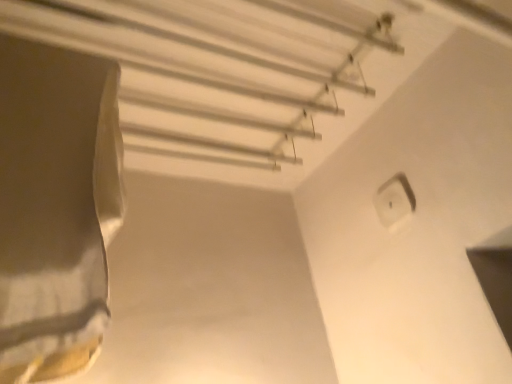
What do you see at coordinates (394, 200) in the screenshot? I see `white plastic electric outlet at upper right` at bounding box center [394, 200].

Locate an element on the screen. The width and height of the screenshot is (512, 384). white plastic electric outlet at upper right is located at coordinates (394, 200).

What is the approximate width of white plastic electric outlet at upper right?

white plastic electric outlet at upper right is 3.46 centimeters in width.

You are a GUI agent. You are given a task and a screenshot of the screen. Output one action in this format:
    pyautogui.click(x=<x>, y=<y>)
    Task: Click on the white plastic electric outlet at upper right
    The width and height of the screenshot is (512, 384).
    Given the screenshot: What is the action you would take?
    pyautogui.click(x=394, y=200)